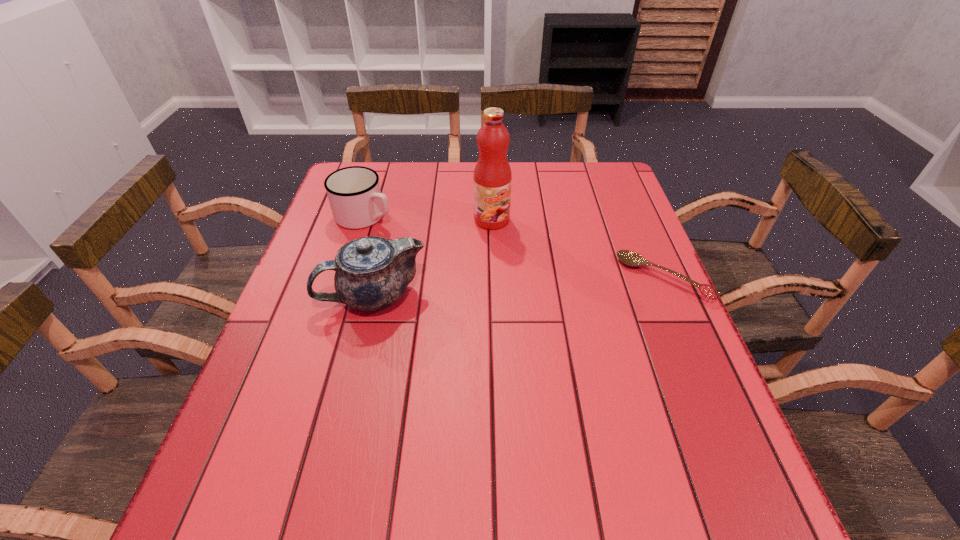
Where is `free point between the mug and the fruit juice`? This screenshot has height=540, width=960. free point between the mug and the fruit juice is located at coordinates (428, 218).

Locate an element on the screen. Image resolution: width=960 pixels, height=540 pixels. free space between the tallest object and the ladle is located at coordinates (578, 249).

Where is `vacant area between the rightmost object and the second shortest object`? This screenshot has height=540, width=960. vacant area between the rightmost object and the second shortest object is located at coordinates (515, 247).

I want to click on free point between the ladle and the mug, so click(x=515, y=247).

Point out which object is positioned as the second nearest to the tallest object. Please provide its 2D coordinates. Your answer should be formatted as a tuple, i.e. [(x, y)], where the tuple contains the x and y coordinates of a point satisfying the conditions above.

[(354, 194)]

Find the location of `object that stands as the second closest to the ladle`. object that stands as the second closest to the ladle is located at coordinates (371, 273).

Identify the location of vacant region that satisfies the following two spatial constraints: 1. on the front side of the fruit juice; 2. on the left side of the second shortest object. (364, 220).